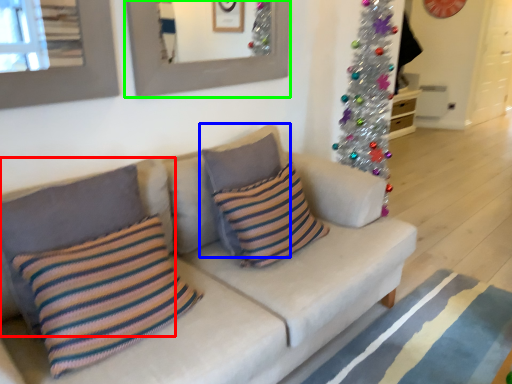
Question: Which is nearer to the pillow (highlighted by a red box)? pillow (highlighted by a blue box) or picture frame (highlighted by a green box).

Choices:
 (A) pillow
 (B) picture frame

Answer: (A)